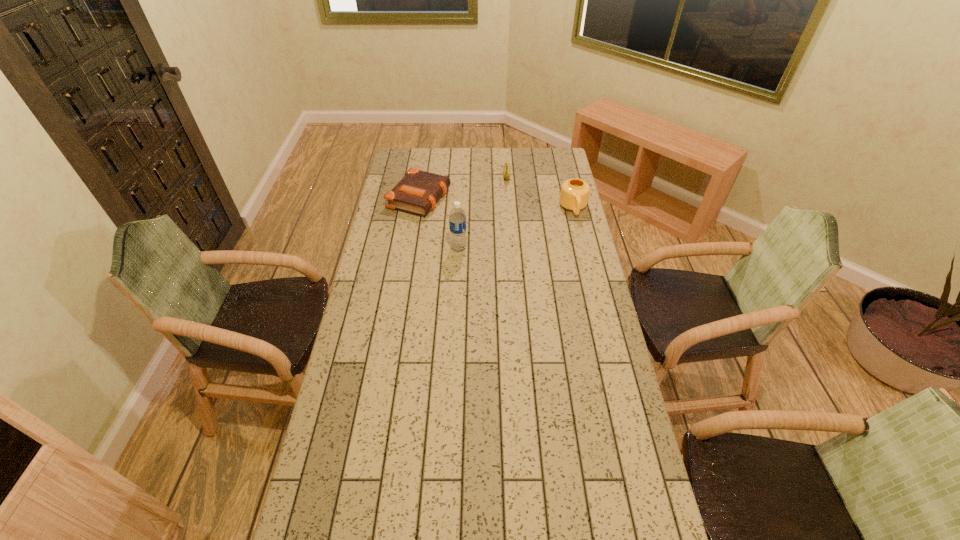
Identify the location of vacant space on the desktop that is between the nearest object and the third shortest object and is positioned on the spine side of the Bible. (525, 225).

Find the location of a particular element. The height and width of the screenshot is (540, 960). free space on the desktop that is between the nearest object and the mug and is positioned at the stem of the second object from right to left is located at coordinates (504, 232).